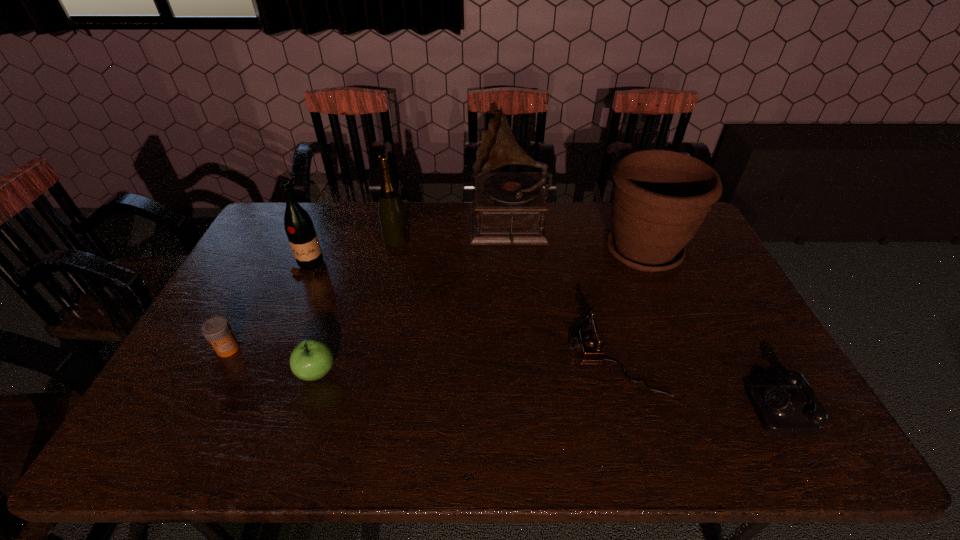
At what (x,y) coordinates should I click in order to perform the action: click on free spot between the right telephone and the apple. Please return your answer as a coordinate pair (x, y). The height and width of the screenshot is (540, 960). Looking at the image, I should click on (546, 387).

In order to click on vacant space in between the third object from left to right and the fifth object from right to left in this screenshot , I will do `click(357, 307)`.

Where is `unoccupied area between the sixth object from right to left and the fourth object from left to right`? The height and width of the screenshot is (540, 960). unoccupied area between the sixth object from right to left and the fourth object from left to right is located at coordinates (357, 307).

Identify the location of vacant space that is in between the shorter telephone and the medicine. (501, 375).

Where is `free space between the farther wine bottle and the nearer wine bottle`? free space between the farther wine bottle and the nearer wine bottle is located at coordinates (354, 254).

You are a GUI agent. You are given a task and a screenshot of the screen. Output one action in this format:
    pyautogui.click(x=<x>, y=<y>)
    Task: Click on the vacant space that is in between the apple and the leftmost object
    The width and height of the screenshot is (960, 540).
    Given the screenshot: What is the action you would take?
    [x=273, y=361]

The image size is (960, 540). What are the coordinates of `free space that is in between the third object from left to right and the tallest object` in the screenshot? It's located at (413, 300).

Locate an element on the screen. The width and height of the screenshot is (960, 540). free space between the left telephone and the nearer wine bottle is located at coordinates click(x=463, y=313).

Where is `the second closest object to the shorter telephone`? the second closest object to the shorter telephone is located at coordinates (660, 198).

Image resolution: width=960 pixels, height=540 pixels. In order to click on the sixth closest object to the tallest object in this screenshot , I will do `click(782, 409)`.